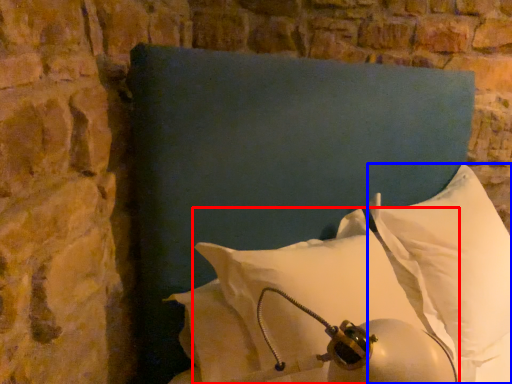
Question: Which object is closer to the camera taking this photo, pillow (highlighted by a red box) or pillow (highlighted by a blue box)?

Choices:
 (A) pillow
 (B) pillow

Answer: (A)